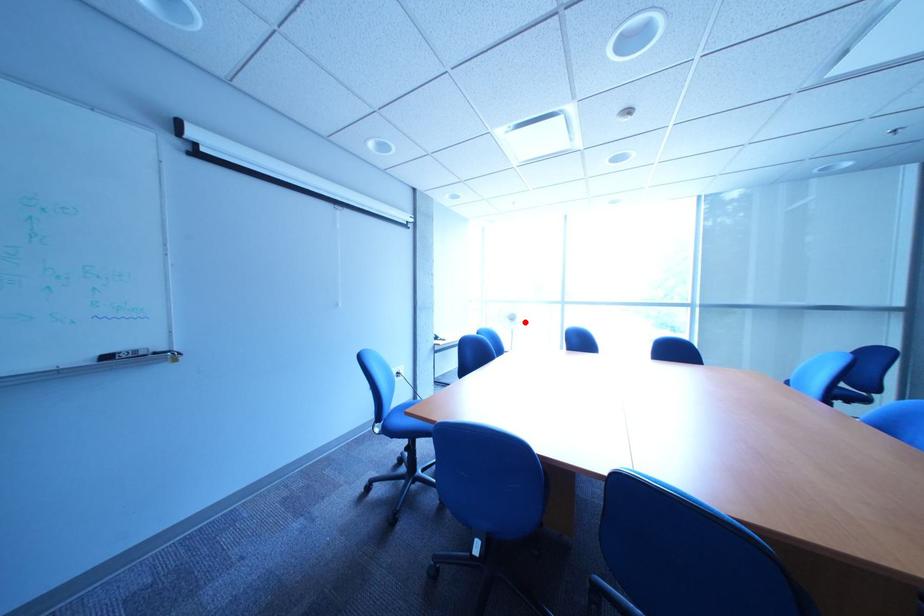
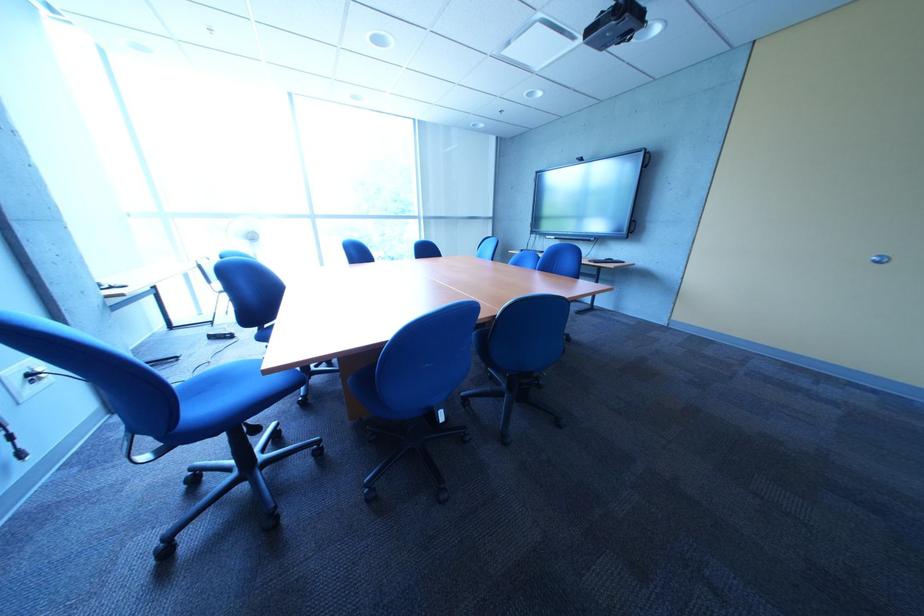
Find the pixel in the second image that matches the highlighted location in the first image.

(262, 244)